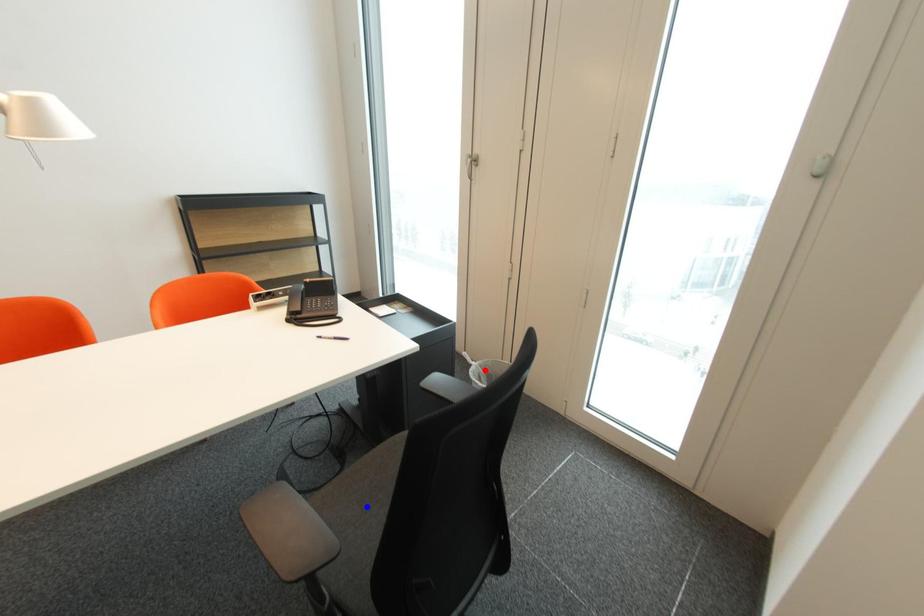
Question: Which of the two points in the image is closer to the camera?

Choices:
 (A) Blue point is closer.
 (B) Red point is closer.

Answer: (A)